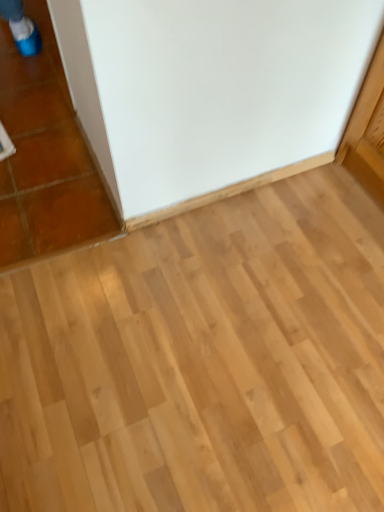
The image size is (384, 512). Identify the location of free space above natural wood floor at center (from a real-world perspective). pos(230,339).